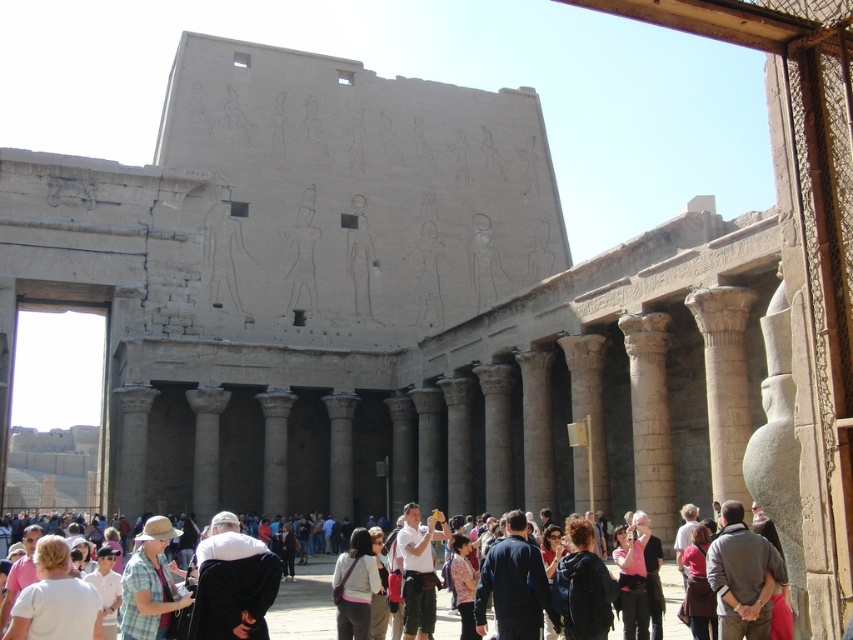
Question: Is dark gray fabric backpack at center smaller than matte pink shirt at center?

Choices:
 (A) yes
 (B) no

Answer: (B)

Question: Which object appears closest to the camera in this image?

Choices:
 (A) dark gray fabric backpack at center
 (B) dark brown leather jacket at lower center

Answer: (B)

Question: Among these points, which one is nearest to the camera?

Choices:
 (A) (469, 600)
 (B) (636, 541)
 (C) (709, 598)
 (D) (363, 621)

Answer: (C)

Question: Does white fabric at center appear under dark gray fabric backpack at center?

Choices:
 (A) no
 (B) yes

Answer: (A)

Question: Which is farther from the matte pink shirt at center?

Choices:
 (A) dark brown leather jacket at lower center
 (B) matte black jacket at lower center

Answer: (A)

Question: Does white fabric at center appear on the left side of dark gray fabric backpack at center?

Choices:
 (A) yes
 (B) no

Answer: (A)